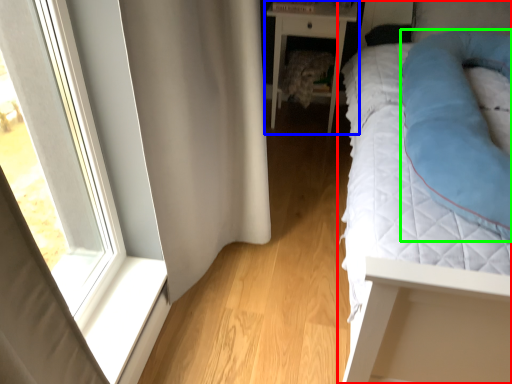
Question: Which object is positioned farthest from bed (highlighted by a red box)? Select from nightstand (highlighted by a blue box) and cat bed (highlighted by a green box).

Choices:
 (A) nightstand
 (B) cat bed

Answer: (A)